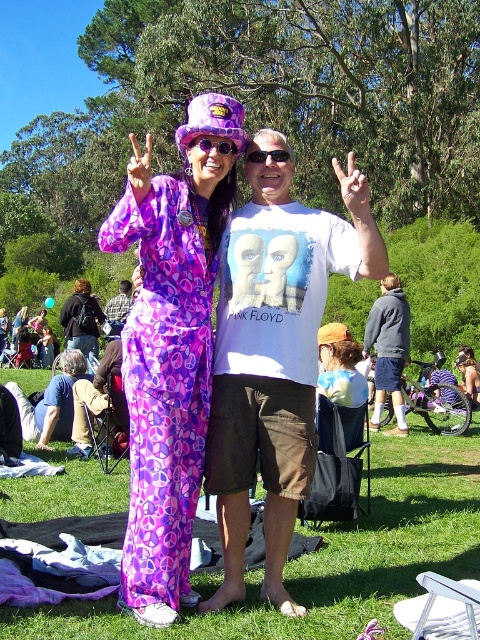
Looking at this image, you are a photographer trying to capture a candid shot of the purple floral dress at center and the white matte hand at center. Since you want to ensure both subjects are in focus, you need to know their relative positions. Which object is positioned to the left of the other?

The purple floral dress at center is to the left of the white matte hand at center.

You are a photographer trying to capture a candid shot of the dark gray hoodie at center and the purple fabric goggles at center in the scene. If your camera has a maximum focus range of 20 feet, will you be able to capture both objects clearly in the same frame?

The dark gray hoodie at center and purple fabric goggles at center are 19.56 feet apart from each other. Since the distance between them is within the camera maximum focus range of 20 feet, you can capture both objects clearly in the same frame.